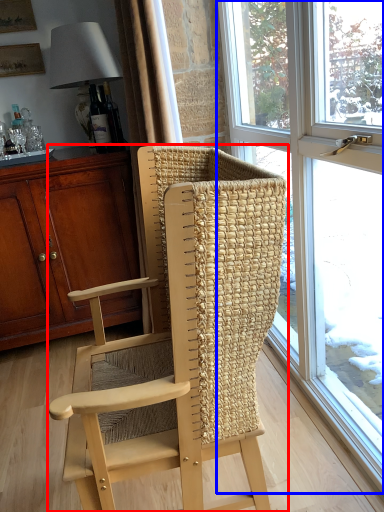
Question: Which object appears closest to the camera in this image, chair (highlighted by a red box) or window (highlighted by a blue box)?

Choices:
 (A) chair
 (B) window

Answer: (A)